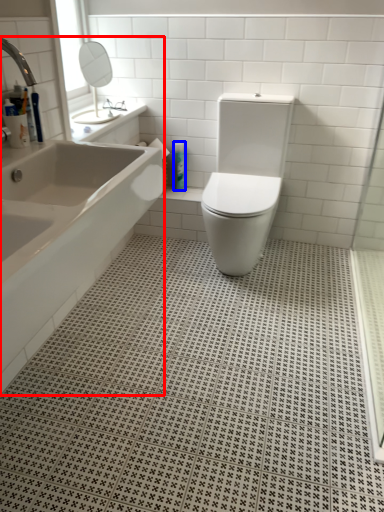
Question: Which object is closer to the camera taking this photo, bathtub (highlighted by a red box) or toiletry (highlighted by a blue box)?

Choices:
 (A) bathtub
 (B) toiletry

Answer: (A)